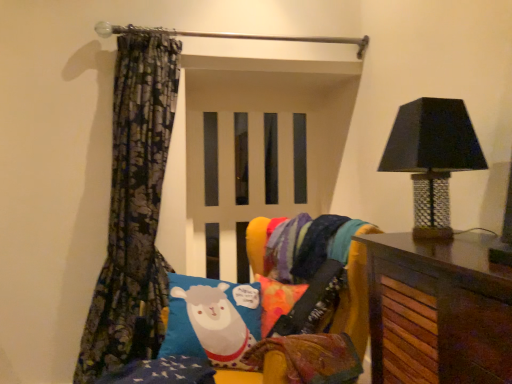
Question: From a real-world perspective, is floral-patterned fabric at left positioned over black mosaic table lamp at right based on gravity?

Choices:
 (A) yes
 (B) no

Answer: (B)

Question: Does floral-patterned fabric at left have a lesser width compared to black mosaic table lamp at right?

Choices:
 (A) no
 (B) yes

Answer: (A)

Question: Is floral-patterned fabric at left oriented towards black mosaic table lamp at right?

Choices:
 (A) yes
 (B) no

Answer: (B)

Question: From the image's perspective, would you say floral-patterned fabric at left is positioned over black mosaic table lamp at right?

Choices:
 (A) no
 (B) yes

Answer: (A)

Question: Considering the relative positions of floral-patterned fabric at left and black mosaic table lamp at right in the image provided, is floral-patterned fabric at left to the right of black mosaic table lamp at right from the viewer's perspective?

Choices:
 (A) yes
 (B) no

Answer: (B)

Question: Does point (150, 354) appear closer or farther from the camera than point (395, 165)?

Choices:
 (A) closer
 (B) farther

Answer: (B)

Question: Is floral-patterned fabric at left bigger or smaller than black mosaic table lamp at right?

Choices:
 (A) big
 (B) small

Answer: (A)

Question: Is floral-patterned fabric at left taller or shorter than black mosaic table lamp at right?

Choices:
 (A) tall
 (B) short

Answer: (A)

Question: Would you say floral-patterned fabric at left is to the left or to the right of black mosaic table lamp at right in the picture?

Choices:
 (A) left
 (B) right

Answer: (A)

Question: Is point (158, 177) closer or farther from the camera than point (357, 244)?

Choices:
 (A) farther
 (B) closer

Answer: (A)

Question: In the image, is floral-patterned fabric at left positioned in front of or behind blue fabric pillow with sheep design at center?

Choices:
 (A) behind
 (B) front

Answer: (A)

Question: Considering the relative positions of floral-patterned fabric at left and blue fabric pillow with sheep design at center in the image provided, is floral-patterned fabric at left to the left or to the right of blue fabric pillow with sheep design at center?

Choices:
 (A) left
 (B) right

Answer: (A)

Question: Choose the correct answer: Is floral-patterned fabric at left inside blue fabric pillow with sheep design at center or outside it?

Choices:
 (A) outside
 (B) inside

Answer: (A)

Question: Is point (117, 355) closer or farther from the camera than point (362, 279)?

Choices:
 (A) farther
 (B) closer

Answer: (A)

Question: In terms of size, does floral-patterned fabric at left appear bigger or smaller than velvet multicolored bean bag chair at center?

Choices:
 (A) big
 (B) small

Answer: (A)